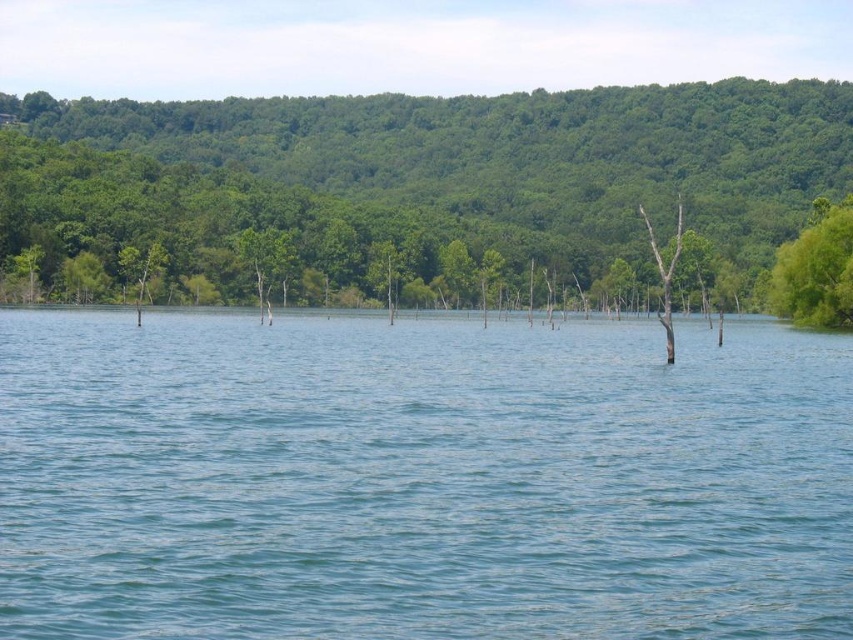
You are standing at the lakeside and want to walk to the green leafy tree at right. Which direction should you move relative to the blue liquid water at center?

You should move to the right of the blue liquid water at center to reach the green leafy tree at right.

You are planning to build a small boat dock at the lakeside. The dock needs to be placed between the blue liquid water at center and the green leafy tree at right. What is the minimum length of the dock required to reach from one to the other?

The minimum length of the dock required to reach from the blue liquid water at center to the green leafy tree at right is 168.22 feet.

You are standing on the lakeside path and want to walk towards both the green leafy tree at right and the brown wood tree at center. Which tree will you reach first?

You will reach the green leafy tree at right first because it is closer to you than the brown wood tree at center, which is further away.